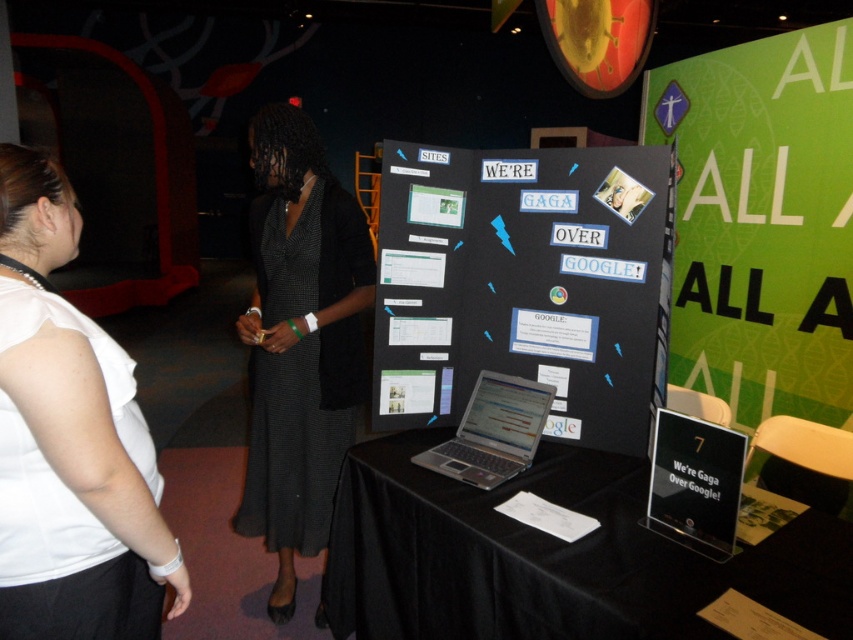
Question: Which is farther from the black clothed table at center?

Choices:
 (A) black textured dress at center
 (B) black matte poster at center
 (C) silver metallic laptop at center
 (D) white fabric shirt at left

Answer: (D)

Question: Considering the relative positions of black matte poster at center and silver metallic laptop at center in the image provided, where is black matte poster at center located with respect to silver metallic laptop at center?

Choices:
 (A) right
 (B) left

Answer: (A)

Question: Is black matte poster at center positioned at the back of black textured dress at center?

Choices:
 (A) no
 (B) yes

Answer: (A)

Question: Which object is the closest to the silver metallic laptop at center?

Choices:
 (A) white fabric shirt at left
 (B) black matte poster at center
 (C) black clothed table at center

Answer: (C)

Question: Estimate the real-world distances between objects in this image. Which object is closer to the white fabric shirt at left?

Choices:
 (A) black textured dress at center
 (B) silver metallic laptop at center

Answer: (B)

Question: Does black textured dress at center appear over white fabric shirt at left?

Choices:
 (A) no
 (B) yes

Answer: (B)